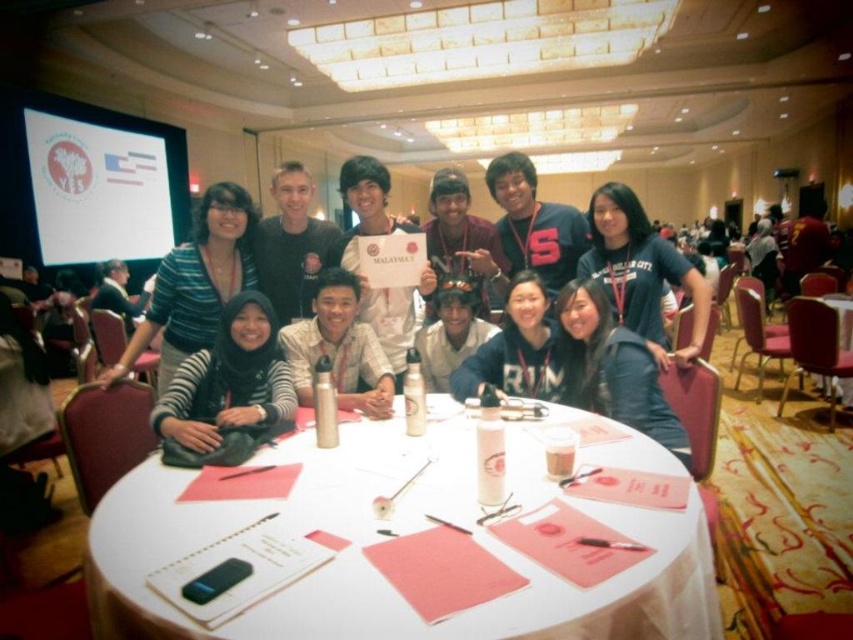
Question: Does black knitwear at center appear under dark blue cotton shirt at center?

Choices:
 (A) no
 (B) yes

Answer: (B)

Question: Estimate the real-world distances between objects in this image. Which object is closer to the matte black hoodie at center?

Choices:
 (A) black knitwear at center
 (B) black matte jacket at center

Answer: (B)

Question: Estimate the real-world distances between objects in this image. Which object is farther from the matte black hoodie at center?

Choices:
 (A) matte silver thermos at center
 (B) black matte jacket at center
 (C) striped fabric shirt at center
 (D) matte black shirt at center

Answer: (C)

Question: Is matte black hoodie at center bigger than dark blue cotton shirt at center?

Choices:
 (A) no
 (B) yes

Answer: (A)

Question: Is white paper at center further to the viewer compared to matte black shirt at center?

Choices:
 (A) yes
 (B) no

Answer: (B)

Question: Which of these objects is positioned closest to the striped fabric shirt at center?

Choices:
 (A) matte black hoodie at center
 (B) matte black shirt at center

Answer: (B)